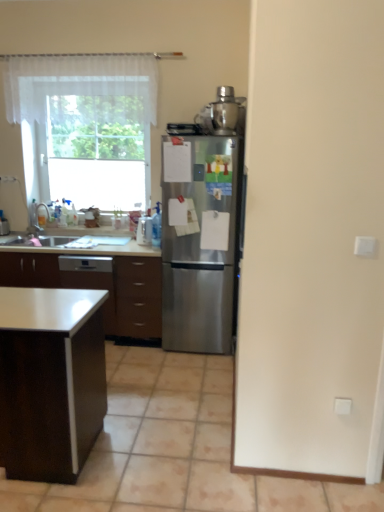
Question: From the image's perspective, is satin silver blender at upper right, positioned as the first appliance in top-to-bottom order, located above brushed metal faucet at left?

Choices:
 (A) yes
 (B) no

Answer: (A)

Question: Does satin silver blender at upper right, which is counted as the first appliance, starting from the right, come behind brushed metal faucet at left?

Choices:
 (A) no
 (B) yes

Answer: (A)

Question: Is satin silver blender at upper right, arranged as the second appliance when ordered from the bottom, taller than brushed metal faucet at left?

Choices:
 (A) no
 (B) yes

Answer: (B)

Question: Would you consider satin silver blender at upper right, arranged as the second appliance when ordered from the bottom, to be distant from brushed metal faucet at left?

Choices:
 (A) yes
 (B) no

Answer: (A)

Question: Can you confirm if satin silver blender at upper right, which is counted as the first appliance, starting from the right, is bigger than brushed metal faucet at left?

Choices:
 (A) no
 (B) yes

Answer: (B)

Question: Looking at their shapes, would you say satin silver blender at upper right, positioned as the first appliance in top-to-bottom order, is wider or thinner than white plastic electric outlet at lower right?

Choices:
 (A) wide
 (B) thin

Answer: (A)

Question: Visually, is satin silver blender at upper right, the 2th appliance from the left, positioned to the left or to the right of white plastic electric outlet at lower right?

Choices:
 (A) left
 (B) right

Answer: (A)

Question: Is satin silver blender at upper right, marked as the 2th appliance in a back-to-front arrangement, bigger or smaller than white plastic electric outlet at lower right?

Choices:
 (A) big
 (B) small

Answer: (A)

Question: Would you say satin silver blender at upper right, the 2th appliance from the left, is inside or outside white plastic electric outlet at lower right?

Choices:
 (A) outside
 (B) inside

Answer: (A)

Question: From their relative heights in the image, would you say clear plastic spray bottle at center, placed as the 2th appliance when sorted from top to bottom, is taller or shorter than satin white dishwasher at lower left?

Choices:
 (A) tall
 (B) short

Answer: (B)

Question: Considering their positions, is clear plastic spray bottle at center, the 1th appliance in the back-to-front sequence, located in front of or behind satin white dishwasher at lower left?

Choices:
 (A) front
 (B) behind

Answer: (B)

Question: Looking at their shapes, would you say clear plastic spray bottle at center, the 1th appliance in the left-to-right sequence, is wider or thinner than satin white dishwasher at lower left?

Choices:
 (A) wide
 (B) thin

Answer: (B)

Question: Is clear plastic spray bottle at center, acting as the second appliance starting from the front, spatially inside satin white dishwasher at lower left, or outside of it?

Choices:
 (A) outside
 (B) inside

Answer: (A)

Question: Considering their positions, is white glossy table at lower left located in front of or behind stainless steel refrigerator at center?

Choices:
 (A) behind
 (B) front

Answer: (B)

Question: In terms of width, does white glossy table at lower left look wider or thinner when compared to stainless steel refrigerator at center?

Choices:
 (A) thin
 (B) wide

Answer: (B)